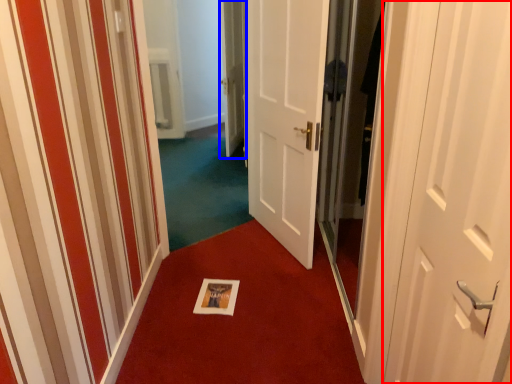
Question: Which object is further to the camera taking this photo, door (highlighted by a red box) or door (highlighted by a blue box)?

Choices:
 (A) door
 (B) door

Answer: (B)